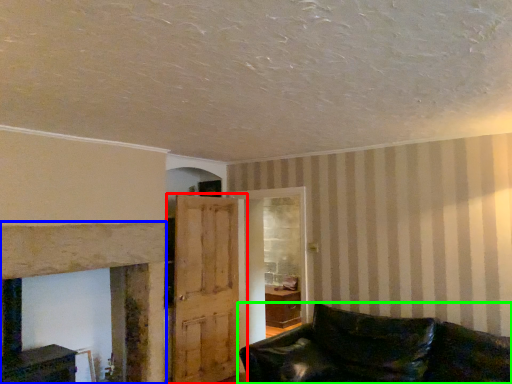
Question: Which is nearer to the door (highlighted by a red box)? fireplace (highlighted by a blue box) or studio couch (highlighted by a green box).

Choices:
 (A) fireplace
 (B) studio couch

Answer: (A)